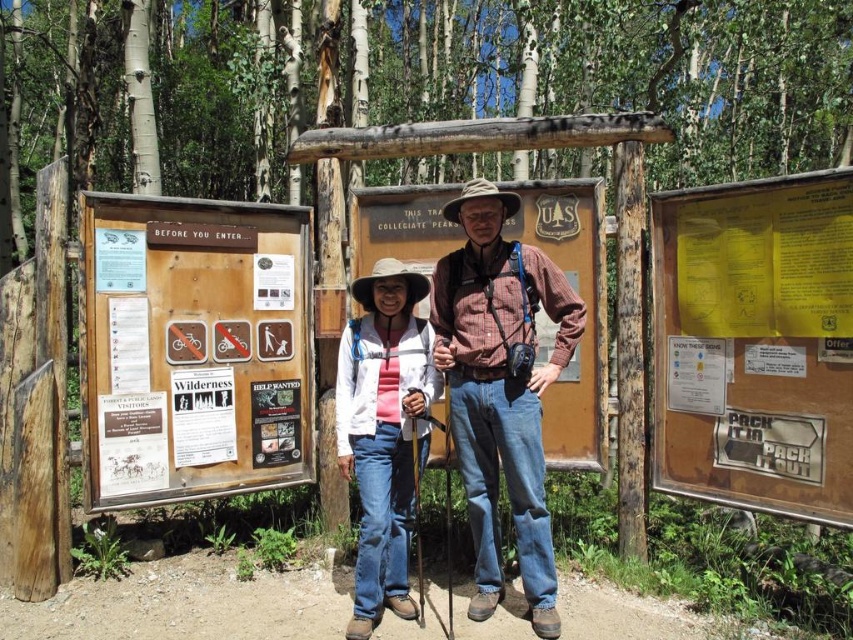
Which object is taller, the wooden sign at left or the white paper wilderness sign at center?

The wooden sign at left is taller than the white paper wilderness sign at center.

What is located at the point with coordinates [190,349]?

The wooden sign at left is located at the point with coordinates [190,349].